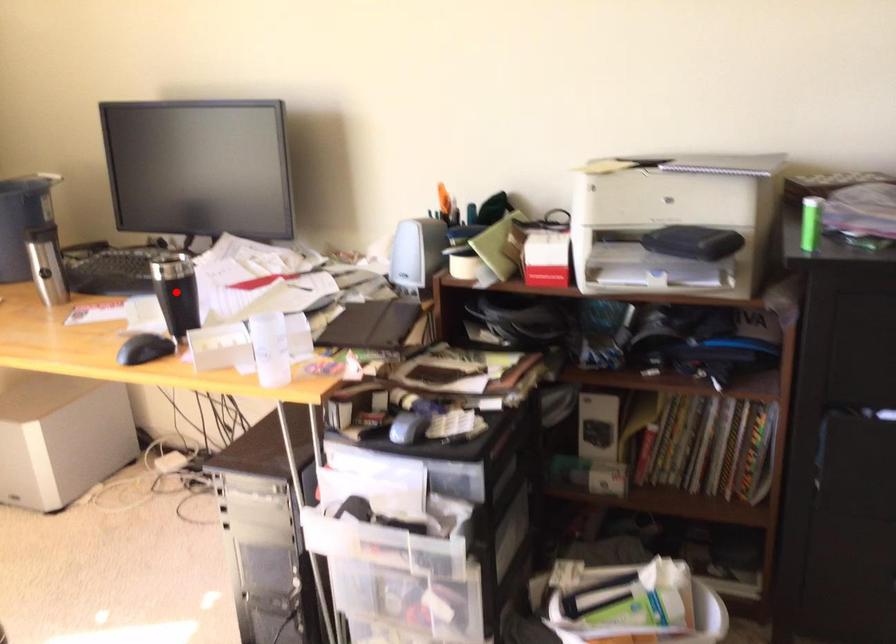
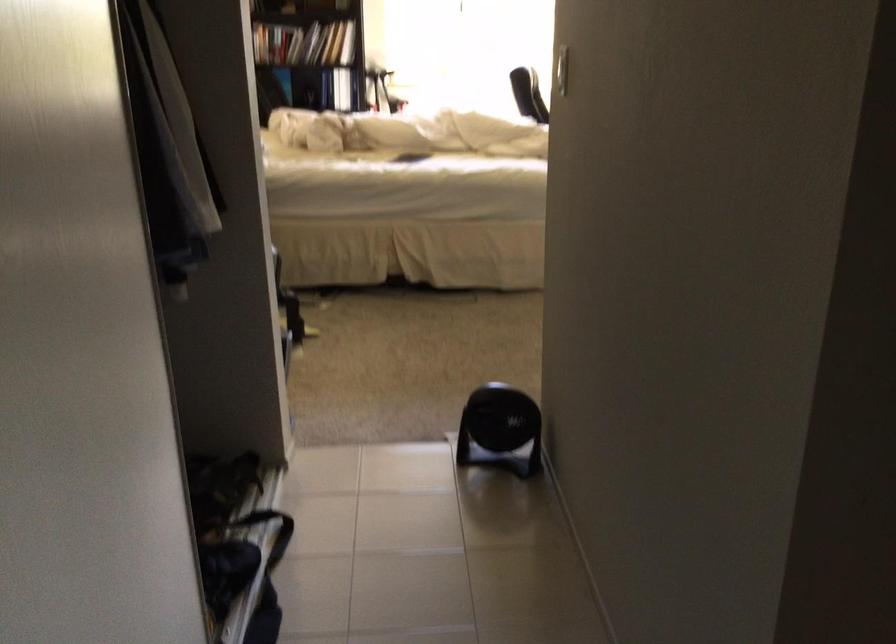
Question: I am providing you with two images of the same scene from different viewpoints. A red point is marked on the first image. At the location where the point appears in image 1, is it still visible in image 2?

Choices:
 (A) Yes
 (B) No

Answer: (B)